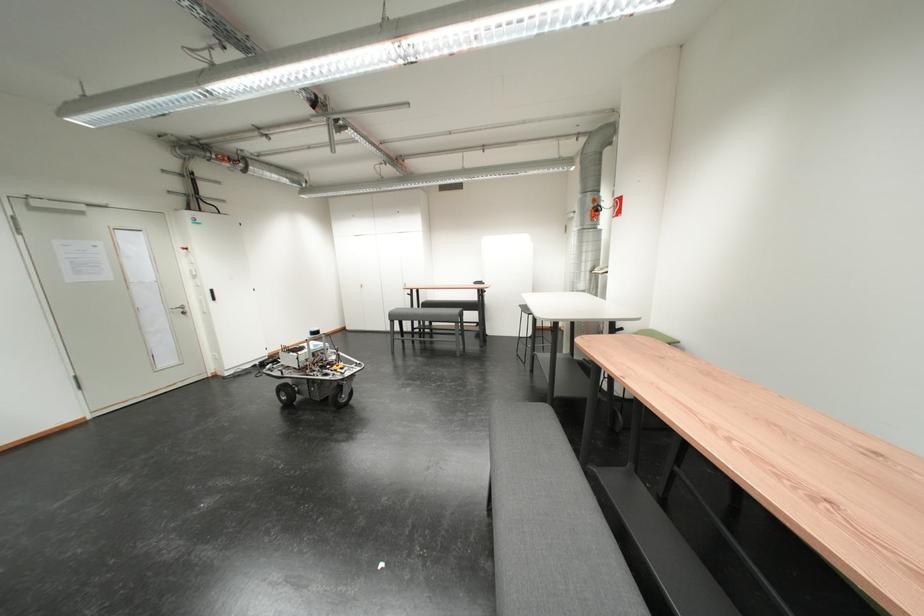
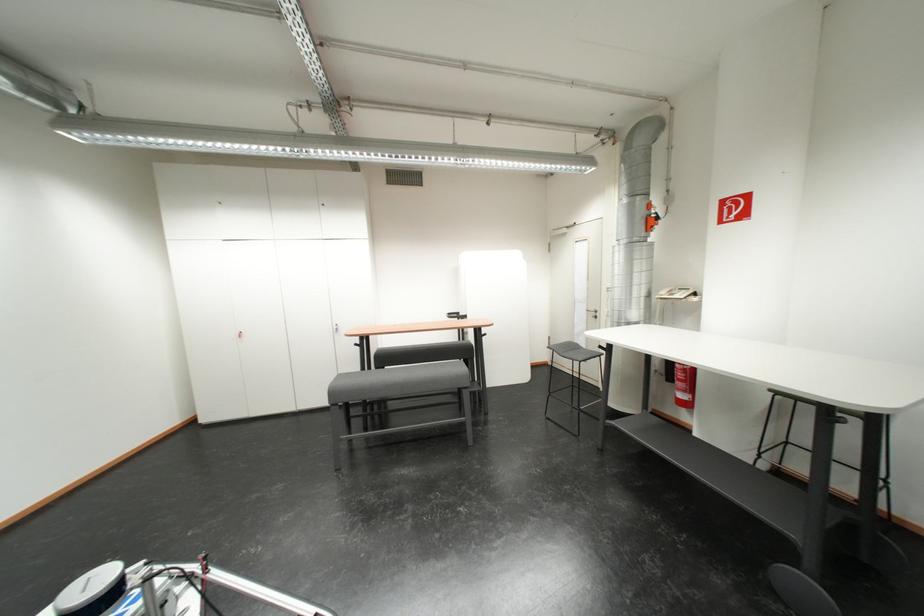
The images are taken continuously from a first-person perspective. In which direction are you moving?

The cameraman walked toward left, forward.